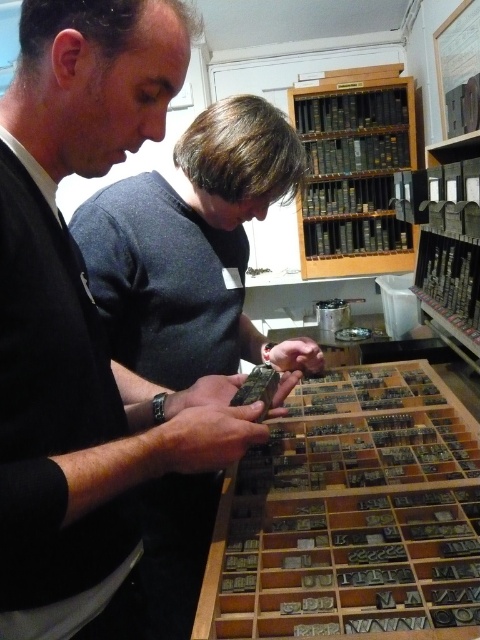
In the scene shown: Does black matte phone at center have a larger size compared to metallic letterpress blocks at center?

Incorrect, black matte phone at center is not larger than metallic letterpress blocks at center.

Is black matte phone at center positioned before metallic letterpress blocks at center?

Yes, black matte phone at center is in front of metallic letterpress blocks at center.

I want to click on black matte phone at center, so click(79, 308).

Can you confirm if metallic letterpress blocks at center is positioned to the right of wooden bookshelf at upper center?

No, metallic letterpress blocks at center is not to the right of wooden bookshelf at upper center.

Is metallic letterpress blocks at center thinner than wooden bookshelf at upper center?

Indeed, metallic letterpress blocks at center has a lesser width compared to wooden bookshelf at upper center.

Does point (298, 500) lie in front of point (406, 256)?

Yes, point (298, 500) is in front of point (406, 256).

Locate an element on the screen. This screenshot has height=640, width=480. metallic letterpress blocks at center is located at coordinates (350, 513).

Between black matte phone at center and wooden bookshelf at upper center, which one has less height?

Standing shorter between the two is black matte phone at center.

The image size is (480, 640). I want to click on black matte phone at center, so click(79, 308).